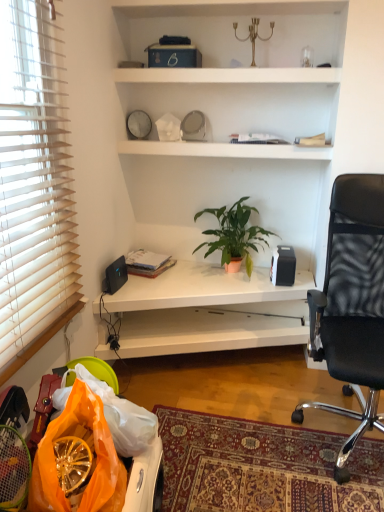
You are a GUI agent. You are given a task and a screenshot of the screen. Output one action in this format:
    pyautogui.click(x=<x>, y=<y>)
    Task: Click on the vacant space in front of matte black book at left
    The image size is (384, 512).
    Given the screenshot: What is the action you would take?
    pyautogui.click(x=149, y=284)